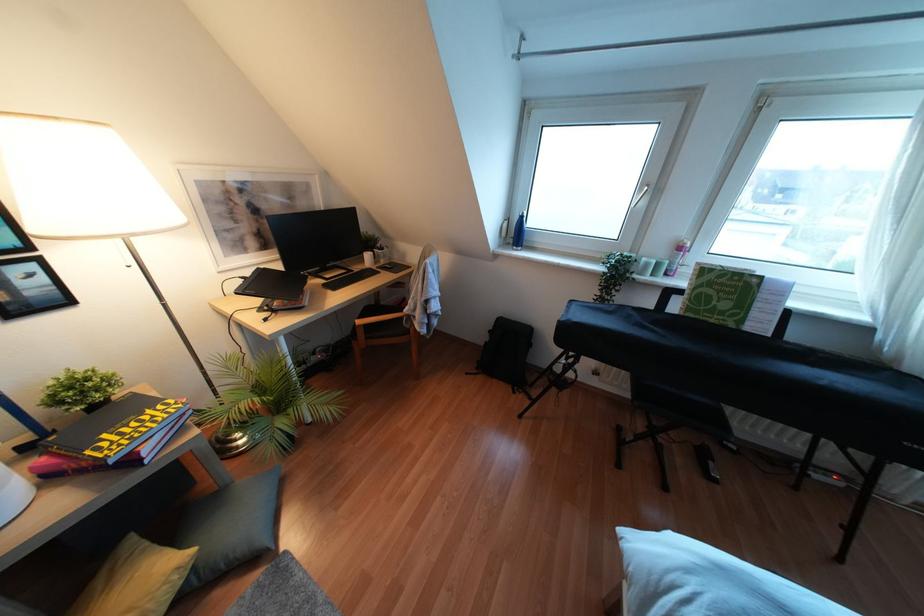
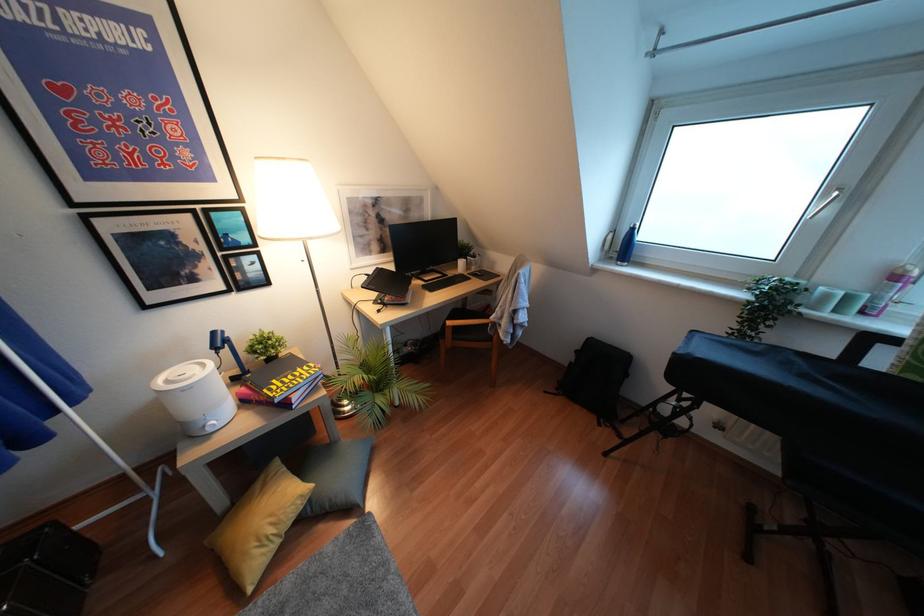
In the second image, find the point that corresponds to (647,185) in the first image.

(839, 188)